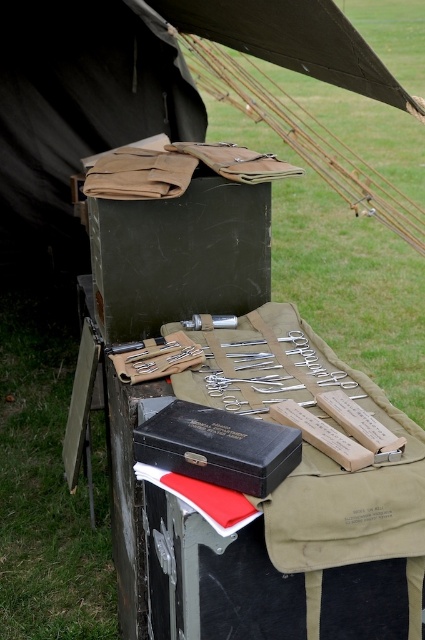
You are a medic at the field medical setup and need to locate the matte black box at center. According to the setup, where exactly is the matte black box positioned relative to the wooden table?

The matte black box at center is located at point coordinates 0.400 in the x axis and 0.421 in the y axis on the wooden table.

You are a medic in the field and need to reach both the point at coordinates point (280, 385) and point (36, 204). Which point should you move towards first to reach the one closer to you?

Point (280, 385) is in front of point (36, 204), so you should move towards point (280, 385) first since it is closer to you.